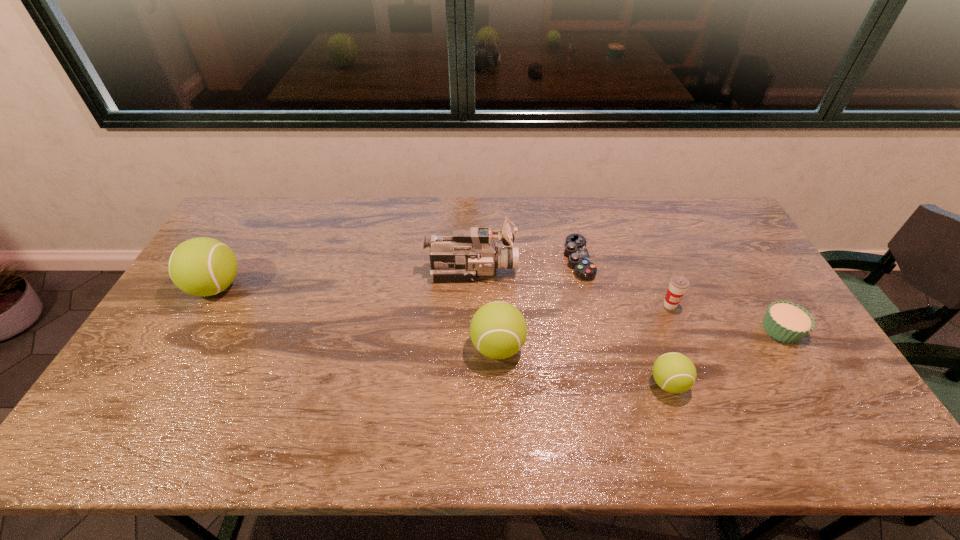
You are a GUI agent. You are given a task and a screenshot of the screen. Output one action in this format:
    pyautogui.click(x=<x>, y=<y>)
    Task: Click on the shortest object
    The height and width of the screenshot is (540, 960).
    Given the screenshot: What is the action you would take?
    (x=579, y=259)

Find the location of a particular element. The height and width of the screenshot is (540, 960). vacant space located on the front of the leftmost tennis ball is located at coordinates (176, 356).

This screenshot has width=960, height=540. I want to click on vacant space located 0.150m on the right of the second tennis ball from left to right, so click(580, 347).

The image size is (960, 540). Find the location of `blank area located on the back of the third object from right to left`. blank area located on the back of the third object from right to left is located at coordinates (655, 342).

Identify the location of blank area located on the front-facing side of the camcorder. This screenshot has width=960, height=540. (535, 269).

I want to click on free space located 0.200m on the back of the rightmost object, so click(743, 267).

What are the coordinates of `vacant area located 0.110m on the side of the cup with the logo` in the screenshot? It's located at (684, 342).

What are the coordinates of `free space located 0.100m on the right of the shortest object` in the screenshot? It's located at (622, 259).

This screenshot has height=540, width=960. Identify the location of object present at the near edge. (674, 372).

I want to click on object positioned at the left edge, so click(x=202, y=266).